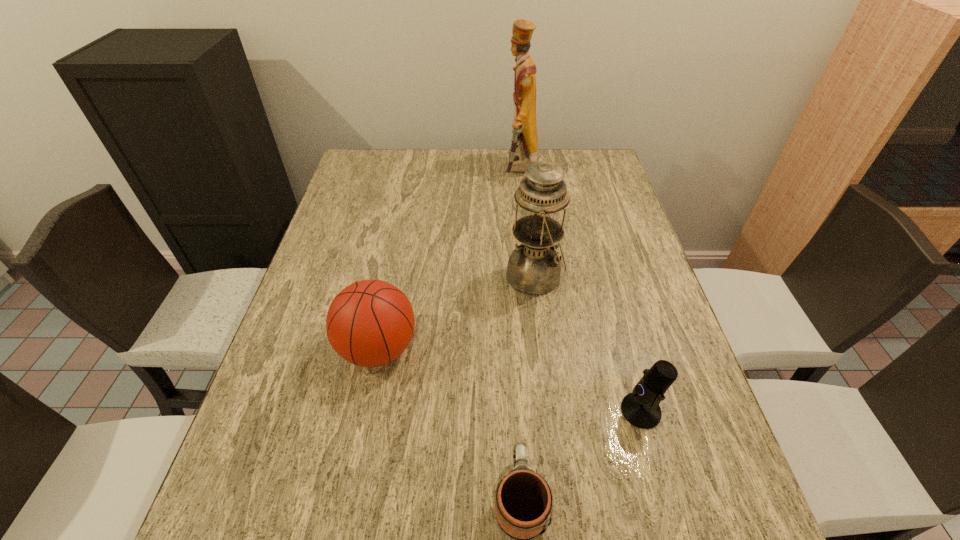
At what (x,y) coordinates should I click in order to perform the action: click on the farthest object. Please return your answer as a coordinate pair (x, y). The width and height of the screenshot is (960, 540). Looking at the image, I should click on (523, 152).

Where is `nutcracker`? Image resolution: width=960 pixels, height=540 pixels. nutcracker is located at coordinates tap(523, 152).

Locate an element on the screen. This screenshot has height=540, width=960. oil lamp is located at coordinates (534, 268).

Image resolution: width=960 pixels, height=540 pixels. I want to click on the fourth shortest object, so click(534, 268).

Locate an element on the screen. The image size is (960, 540). the third tallest object is located at coordinates (370, 323).

Find the location of `basketball`. basketball is located at coordinates (370, 323).

Find the location of a particular element. The width and height of the screenshot is (960, 540). microphone is located at coordinates (640, 408).

Where is `the fourth farthest object`? the fourth farthest object is located at coordinates (640, 408).

At what (x,y) coordinates should I click in order to perform the action: click on free location located on the front-facing side of the tallest object. Please return your answer as a coordinate pair (x, y). Image resolution: width=960 pixels, height=540 pixels. Looking at the image, I should click on (431, 170).

The image size is (960, 540). In order to click on free spot located on the front-facing side of the tallest object in this screenshot , I will do `click(478, 170)`.